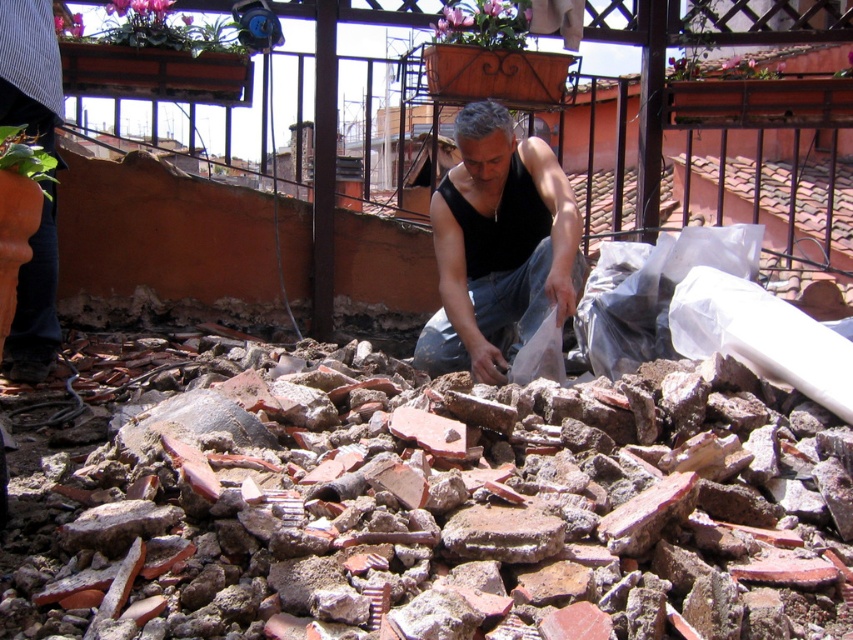
You are a safety inspector visiting the rooftop scene. You notice the brick rubble at center and the black matte vest at center. According to safety regulations, the vest must be visible from a distance. Considering their sizes, which object is more likely to be easily seen from afar?

The brick rubble at center is bigger than the black matte vest at center, so the brick rubble at center would be more easily seen from afar due to its larger size.

Based on the photo, you are standing at the point labeled as point (749,612) and want to toss a small stone to someone standing 2.5 meters away from you. Can you reach them with your throw?

The distance between you and the person is 2.5 meters, while the point (749,612) is 2.10 meters away from the viewer. Since 2.5 meters is slightly farther than 2.10 meters, you might need a stronger throw to reach them.